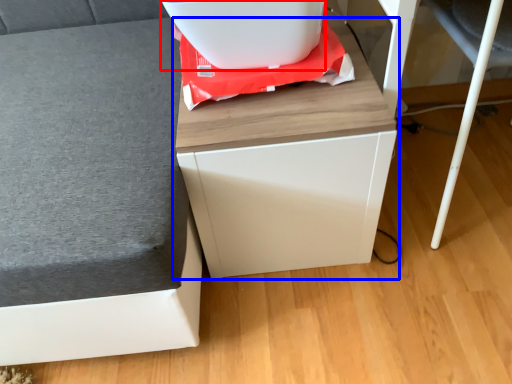
Question: Among these objects, which one is farthest to the camera, appliance (highlighted by a red box) or furniture (highlighted by a blue box)?

Choices:
 (A) appliance
 (B) furniture

Answer: (A)